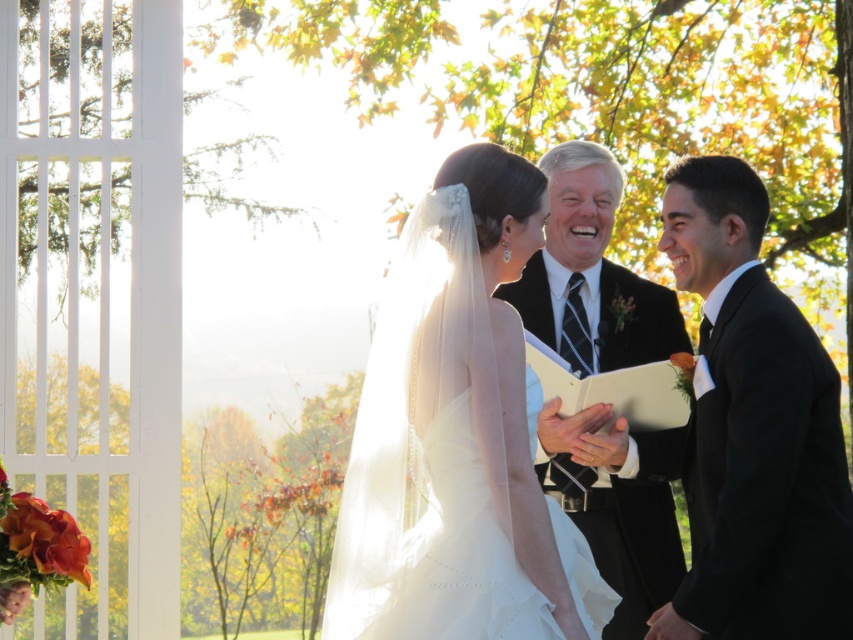
From the picture: Does black satin suit at right have a smaller size compared to black satin suit at center?

No, black satin suit at right is not smaller than black satin suit at center.

Who is more forward, (677, 241) or (596, 244)?

Point (677, 241) is more forward.

Is point (846, 561) in front of point (601, 212)?

That is True.

Where is `black satin suit at right`? black satin suit at right is located at coordinates (753, 429).

Does white satin dress at center have a greater height compared to black satin suit at right?

Yes, white satin dress at center is taller than black satin suit at right.

Does white satin dress at center come behind black satin suit at right?

No, it is in front of black satin suit at right.

Between point (451, 221) and point (766, 378), which one is positioned in front?

Point (766, 378) is in front.

The image size is (853, 640). Find the location of `white satin dress at center`. white satin dress at center is located at coordinates (456, 438).

Based on the photo, measure the distance between white satin dress at center and black satin suit at center.

The distance of white satin dress at center from black satin suit at center is 2.39 meters.

Measure the distance between white satin dress at center and black satin suit at center.

The distance of white satin dress at center from black satin suit at center is 2.39 meters.

Is point (390, 300) positioned after point (660, 339)?

No, it is in front of (660, 339).

Identify the location of white satin dress at center. (456, 438).